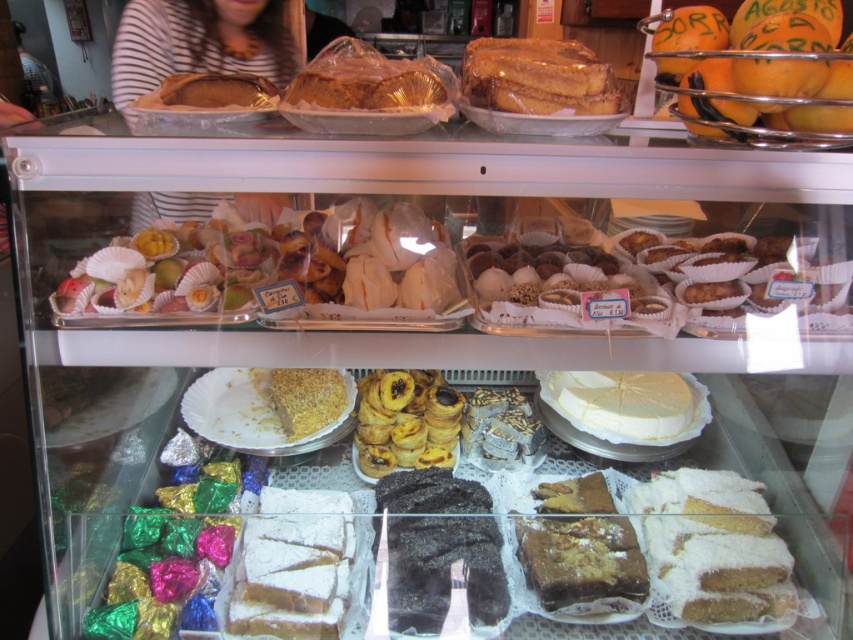
Does black matte cake at center come in front of white cream cheese at center?

No, it is not.

Who is positioned more to the right, black matte cake at center or white cream cheese at center?

From the viewer's perspective, white cream cheese at center appears more on the right side.

What do you see at coordinates (439, 548) in the screenshot?
I see `black matte cake at center` at bounding box center [439, 548].

Where is `black matte cake at center`? This screenshot has width=853, height=640. black matte cake at center is located at coordinates click(439, 548).

Which of these two, powdered white cake at center or golden flaky pastry at center, stands shorter?

powdered white cake at center

Is powdered white cake at center positioned at the back of golden flaky pastry at center?

No, it is in front of golden flaky pastry at center.

Describe the element at coordinates (293, 564) in the screenshot. I see `powdered white cake at center` at that location.

Find the location of a particular element. This screenshot has height=640, width=853. powdered white cake at center is located at coordinates (293, 564).

Describe the element at coordinates (714, 547) in the screenshot. I see `powdered sugar cake at lower right` at that location.

Is point (633, 496) farther from viewer compared to point (270, 604)?

Yes, it is.

Does point (724, 577) come in front of point (352, 547)?

Yes, it is in front of point (352, 547).

You are a GUI agent. You are given a task and a screenshot of the screen. Output one action in this format:
    pyautogui.click(x=<x>, y=<y>)
    Task: Click on the powdered sugar cake at lower right
    Image resolution: width=853 pixels, height=640 pixels.
    Given the screenshot: What is the action you would take?
    pyautogui.click(x=714, y=547)